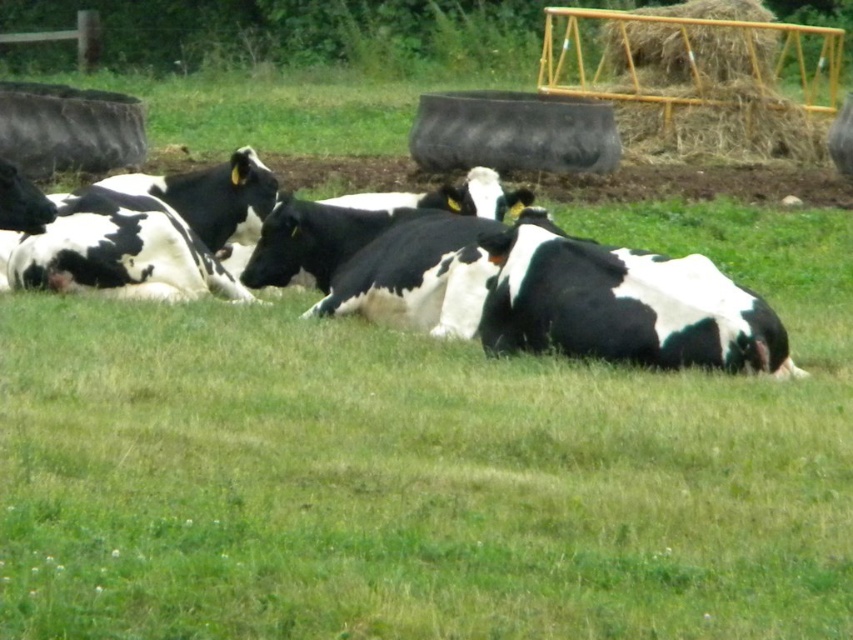
Question: Does black and white cow at center have a greater width compared to yellow metal hay at upper right?

Choices:
 (A) no
 (B) yes

Answer: (B)

Question: From the image, what is the correct spatial relationship of black and white cow at center in relation to yellow metal hay at upper right?

Choices:
 (A) left
 (B) right

Answer: (A)

Question: Which point is closer to the camera?

Choices:
 (A) yellow metal hay at upper right
 (B) black and white cow at center

Answer: (B)

Question: Is black and white cow at center bigger than yellow metal hay at upper right?

Choices:
 (A) no
 (B) yes

Answer: (A)

Question: Which point is farther to the camera?

Choices:
 (A) black and white cow at center
 (B) yellow metal hay at upper right

Answer: (B)

Question: Which point appears farthest from the camera in this image?

Choices:
 (A) (556, 252)
 (B) (613, 52)

Answer: (B)